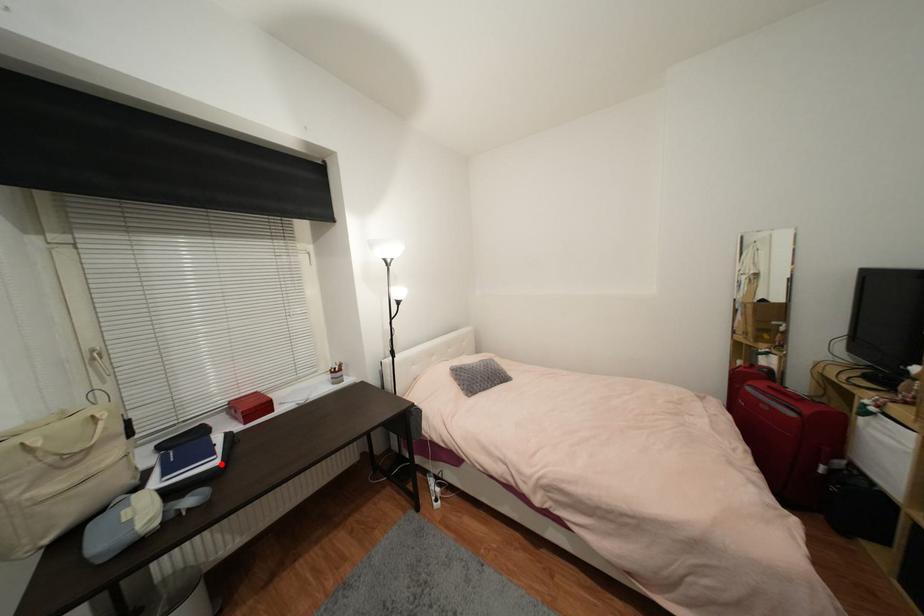
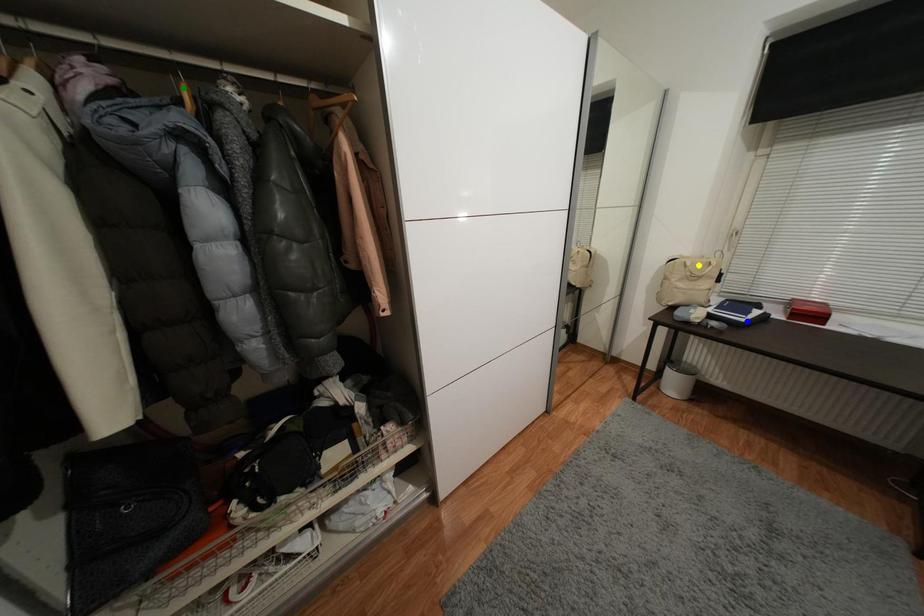
Question: I am providing you with two images of the same scene from different viewpoints. A red point is marked on the first image. You are given multiple points on the second image. Can you choose the point in image 2 that corresponds to the point in image 1?

Choices:
 (A) green point
 (B) yellow point
 (C) blue point

Answer: (C)